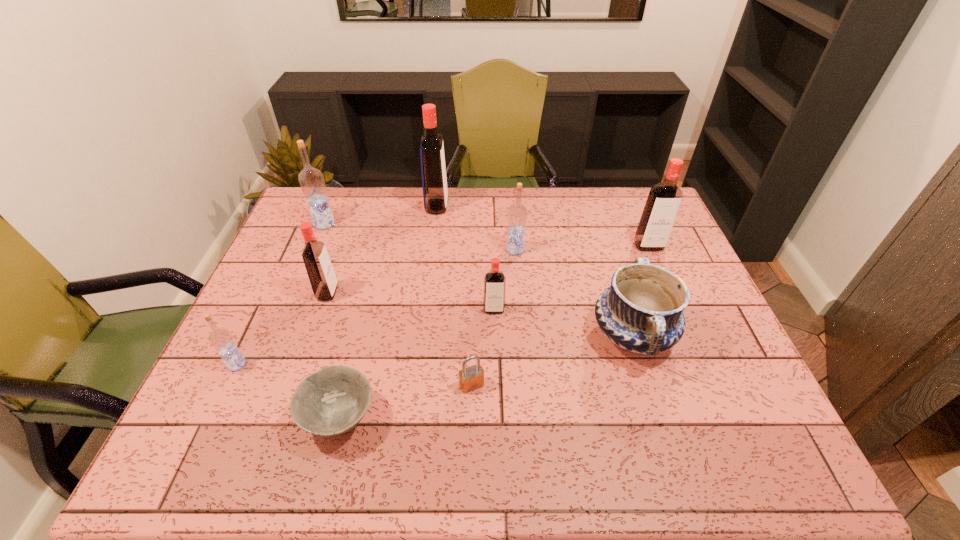
In order to click on pottery in this screenshot , I will do `click(642, 311)`.

This screenshot has height=540, width=960. What are the coordinates of `the fifth vodka from left to right` in the screenshot? It's located at (494, 281).

I want to click on the smallest red vodka, so click(494, 281).

At what (x,y) coordinates should I click in order to perform the action: click on the leftmost object. Please return your answer as a coordinate pair (x, y). Looking at the image, I should click on [x=221, y=339].

This screenshot has width=960, height=540. I want to click on the nearest vodka, so click(x=221, y=339).

Identify the location of padlock. This screenshot has height=540, width=960. (470, 378).

At what (x,y) coordinates should I click in order to perform the action: click on the shortest object. Please return your answer as a coordinate pair (x, y). Looking at the image, I should click on (333, 400).

This screenshot has width=960, height=540. Find the location of `the seventh object from right to left`. the seventh object from right to left is located at coordinates (333, 400).

At what (x,y) coordinates should I click in order to perform the action: click on vacant space located on the front and back of the farthest object. Please return your answer as a coordinate pair (x, y). Looking at the image, I should click on (556, 206).

Image resolution: width=960 pixels, height=540 pixels. What are the coordinates of `vacant area situated on the right of the farthest blue vodka` in the screenshot? It's located at click(x=392, y=224).